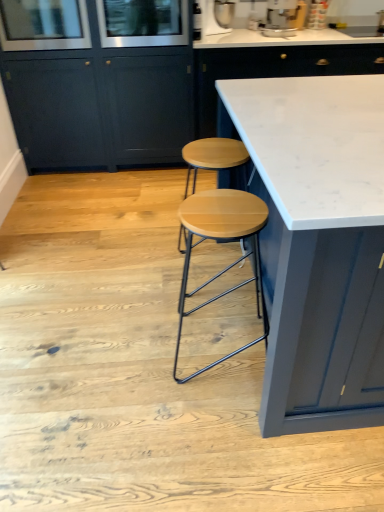
Question: From the image's perspective, is clear glass screen door at upper left, acting as the 2th screen door starting from the right, located beneath metallic silver coffee machine at upper center, which is counted as the second appliance, starting from the left?

Choices:
 (A) yes
 (B) no

Answer: (A)

Question: Is clear glass screen door at upper left, which ranks as the first screen door in left-to-right order, behind metallic silver coffee machine at upper center, the first appliance when ordered from right to left?

Choices:
 (A) yes
 (B) no

Answer: (B)

Question: Does clear glass screen door at upper left, which ranks as the first screen door in left-to-right order, have a lesser width compared to metallic silver coffee machine at upper center, the first appliance when ordered from right to left?

Choices:
 (A) no
 (B) yes

Answer: (A)

Question: Is clear glass screen door at upper left, acting as the 2th screen door starting from the right, bigger than metallic silver coffee machine at upper center, which is counted as the second appliance, starting from the left?

Choices:
 (A) no
 (B) yes

Answer: (B)

Question: Is clear glass screen door at upper left, acting as the 2th screen door starting from the right, at the left side of metallic silver coffee machine at upper center, which is counted as the second appliance, starting from the left?

Choices:
 (A) yes
 (B) no

Answer: (A)

Question: Is wooden seat stool at center taller or shorter than clear glass screen door at upper center, which ranks as the second screen door in left-to-right order?

Choices:
 (A) tall
 (B) short

Answer: (A)

Question: Based on their sizes in the image, would you say wooden seat stool at center is bigger or smaller than clear glass screen door at upper center, which ranks as the second screen door in left-to-right order?

Choices:
 (A) big
 (B) small

Answer: (A)

Question: Is point (266, 216) positioned closer to the camera than point (178, 26)?

Choices:
 (A) closer
 (B) farther

Answer: (A)

Question: From a real-world perspective, is wooden seat stool at center above or below clear glass screen door at upper center, which ranks as the second screen door in left-to-right order?

Choices:
 (A) below
 (B) above

Answer: (A)

Question: Considering the positions of clear glass screen door at upper left, which ranks as the first screen door in left-to-right order, and metallic silver stand mixer at upper center, marked as the 2th appliance in a right-to-left arrangement, in the image, is clear glass screen door at upper left, which ranks as the first screen door in left-to-right order, bigger or smaller than metallic silver stand mixer at upper center, marked as the 2th appliance in a right-to-left arrangement,?

Choices:
 (A) small
 (B) big

Answer: (B)

Question: From the image's perspective, is clear glass screen door at upper left, which ranks as the first screen door in left-to-right order, positioned above or below metallic silver stand mixer at upper center, marked as the 2th appliance in a right-to-left arrangement?

Choices:
 (A) below
 (B) above

Answer: (A)

Question: In terms of width, does clear glass screen door at upper left, which ranks as the first screen door in left-to-right order, look wider or thinner when compared to metallic silver stand mixer at upper center, marked as the 2th appliance in a right-to-left arrangement?

Choices:
 (A) wide
 (B) thin

Answer: (A)

Question: From their relative heights in the image, would you say clear glass screen door at upper left, acting as the 2th screen door starting from the right, is taller or shorter than metallic silver stand mixer at upper center, marked as the 2th appliance in a right-to-left arrangement?

Choices:
 (A) tall
 (B) short

Answer: (A)

Question: From a real-world perspective, is clear glass screen door at upper left, acting as the 2th screen door starting from the right, physically located above or below wooden seat stool at center?

Choices:
 (A) below
 (B) above

Answer: (B)

Question: Relative to wooden seat stool at center, is clear glass screen door at upper left, which ranks as the first screen door in left-to-right order, in front or behind?

Choices:
 (A) front
 (B) behind

Answer: (B)